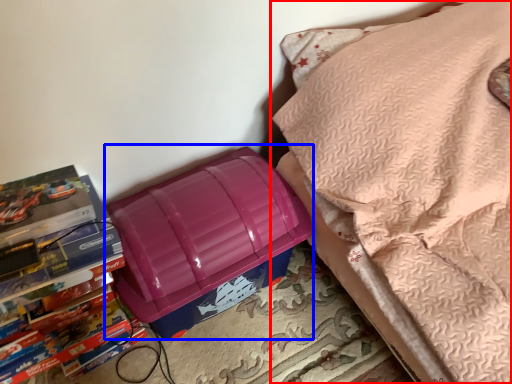
Question: Which object appears closest to the camera in this image, furniture (highlighted by a red box) or lunch box (highlighted by a blue box)?

Choices:
 (A) furniture
 (B) lunch box

Answer: (A)